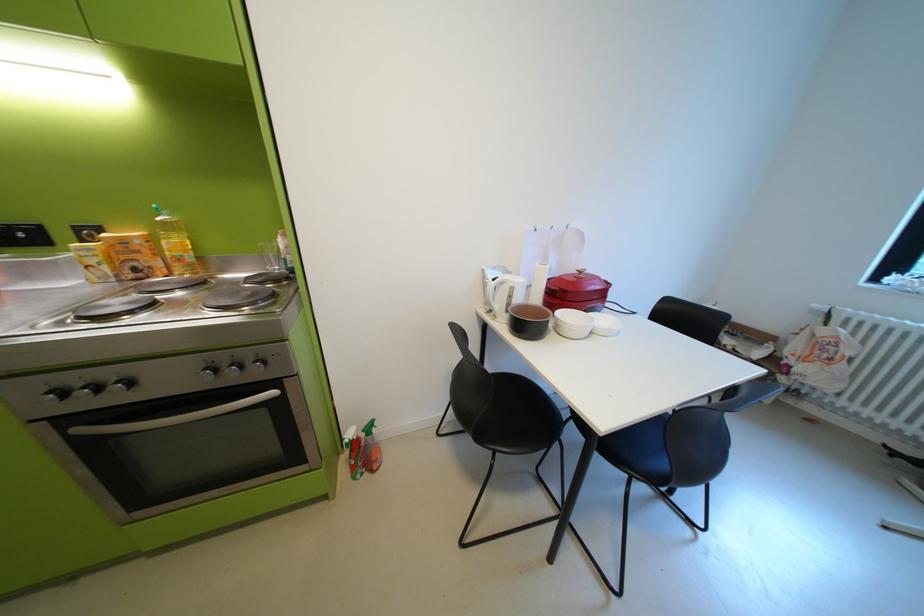
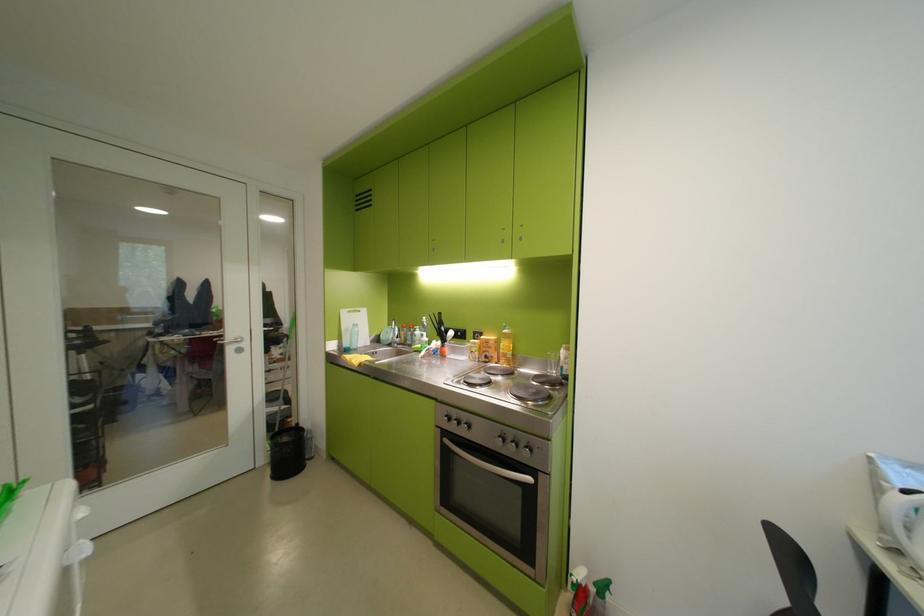
In the second image, find the point that corresponds to (358,440) in the first image.

(585, 581)